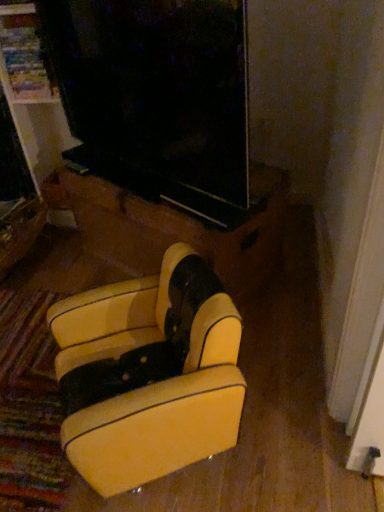
Question: Considering the relative sizes of leather armchair at center, which is the second furniture from front to back, and wooden drawer at lower left in the image provided, is leather armchair at center, which is the second furniture from front to back, bigger than wooden drawer at lower left?

Choices:
 (A) no
 (B) yes

Answer: (B)

Question: From the image's perspective, is leather armchair at center, which is the first furniture in back-to-front order, over wooden drawer at lower left?

Choices:
 (A) yes
 (B) no

Answer: (A)

Question: Does leather armchair at center, which is the second furniture from front to back, appear on the left side of wooden drawer at lower left?

Choices:
 (A) no
 (B) yes

Answer: (A)

Question: Is leather armchair at center, which is the second furniture from front to back, far from wooden drawer at lower left?

Choices:
 (A) yes
 (B) no

Answer: (B)

Question: Is leather armchair at center, which is the second furniture from front to back, turned away from wooden drawer at lower left?

Choices:
 (A) no
 (B) yes

Answer: (A)

Question: Considering the relative sizes of leather armchair at center, which is the second furniture from front to back, and wooden drawer at lower left in the image provided, is leather armchair at center, which is the second furniture from front to back, thinner than wooden drawer at lower left?

Choices:
 (A) no
 (B) yes

Answer: (A)

Question: From the image's perspective, is wooden drawer at lower left over leather armchair at center, which is the second furniture from front to back?

Choices:
 (A) yes
 (B) no

Answer: (B)

Question: Can you confirm if wooden drawer at lower left is shorter than leather armchair at center, which is the second furniture from front to back?

Choices:
 (A) yes
 (B) no

Answer: (A)

Question: Is wooden drawer at lower left taller than leather armchair at center, which is the second furniture from front to back?

Choices:
 (A) no
 (B) yes

Answer: (A)

Question: Does wooden drawer at lower left appear on the right side of leather armchair at center, which is the first furniture in back-to-front order?

Choices:
 (A) yes
 (B) no

Answer: (B)

Question: Is wooden drawer at lower left to the left of leather armchair at center, which is the second furniture from front to back, from the viewer's perspective?

Choices:
 (A) no
 (B) yes

Answer: (B)

Question: Considering the relative positions of wooden drawer at lower left and leather armchair at center, which is the second furniture from front to back, in the image provided, is wooden drawer at lower left behind leather armchair at center, which is the second furniture from front to back,?

Choices:
 (A) no
 (B) yes

Answer: (B)

Question: Does yellow leather armchair at lower center, which ranks as the second furniture in back-to-front order, have a larger size compared to wooden drawer at lower left?

Choices:
 (A) yes
 (B) no

Answer: (A)